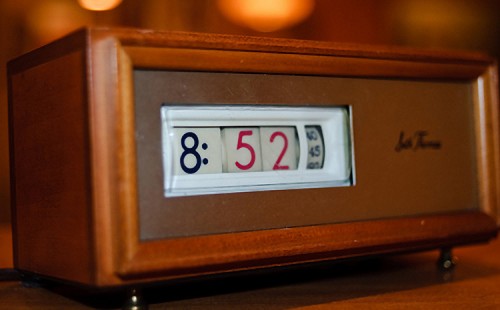
The height and width of the screenshot is (310, 500). I want to click on white window frame showing time, so click(262, 116).